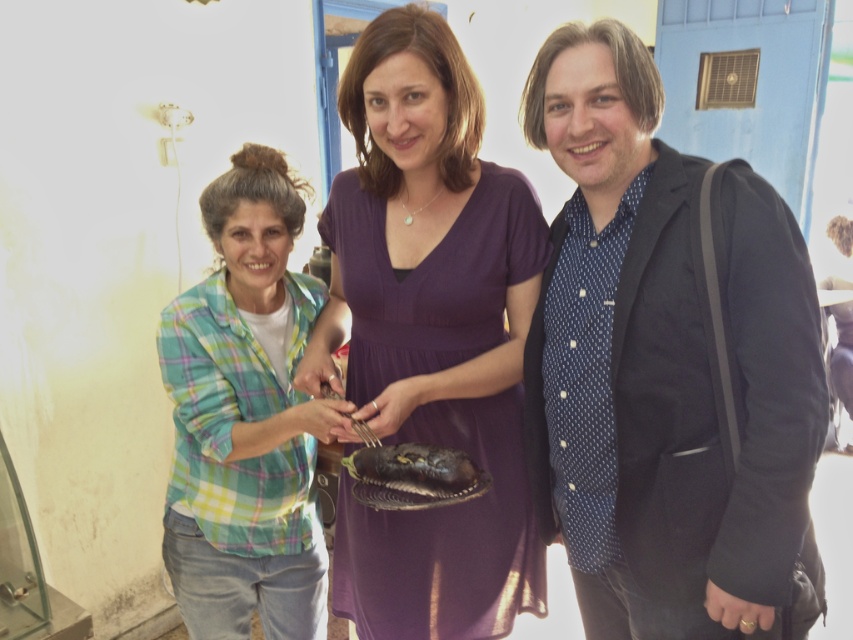
You are a photographer setting up for a group photo. You want to ensure that the matte black blazer at center and the green plaid shirt at left are both clearly visible in the frame. Based on their positions, which one might you need to adjust to avoid being blocked?

The matte black blazer at center is in front of the green plaid shirt at left, so you might need to adjust the green plaid shirt at left to move it forward or reposition the matte black blazer at center to ensure both are visible.

You are a delivery person with a package that requires a signature. You see the two people in the scene, the matte black blazer at center and the green plaid shirt at left. Which person is closer to you, the delivery person, based on their positions?

The matte black blazer at center and the green plaid shirt at left are 21.05 inches apart. Since the distance between them is specified, but the exact positions relative to the viewer aren not given, it is impossible to determine which is closer without additional information about their arrangement from your perspective.

You are a photographer setting up a shoot in this room. You need to position a spotlight that can illuminate both the matte black blazer at center and the green plaid shirt at left. Based on their positions, which object should be placed higher to ensure both are evenly lit?

The matte black blazer at center is located above the green plaid shirt at left, so to ensure both are evenly lit, the spotlight should be placed higher to account for the blazer being positioned above the shirt.